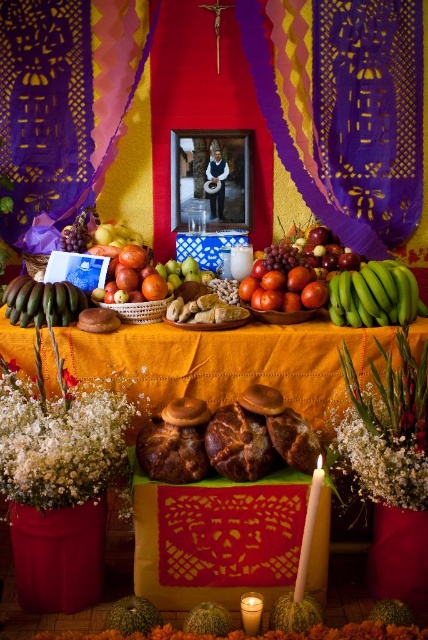
You are standing in front of the altar and want to place a new offering. There are two spots marked by coordinates on the altar where you can place it. The first spot is at point [326,288] and the second is at point [130,234]. Which spot is closer to you?

Point [326,288] is closer to the camera than point [130,234], so the first spot at point [326,288] is closer to you.

You are setting up a DIA DE LOS MUERTOS altar and have two offerings to place at the center. You have the shiny red tomatoes at center and the yellow matte apples at center. Which offering takes up more space on the altar?

The yellow matte apples at center take up more space than the shiny red tomatoes at center because the shiny red tomatoes at center occupies less space than yellow matte apples at center.

You are setting up a DIA DE LOS MUERTOS altar and want to place a new offering between the golden textured bread at center and the white fluffy flowers at center. Based on their positions, where should you place the new offering?

The golden textured bread at center is located above the white fluffy flowers at center, so you should place the new offering between them either below the bread and above the flowers or in between their vertical positions.